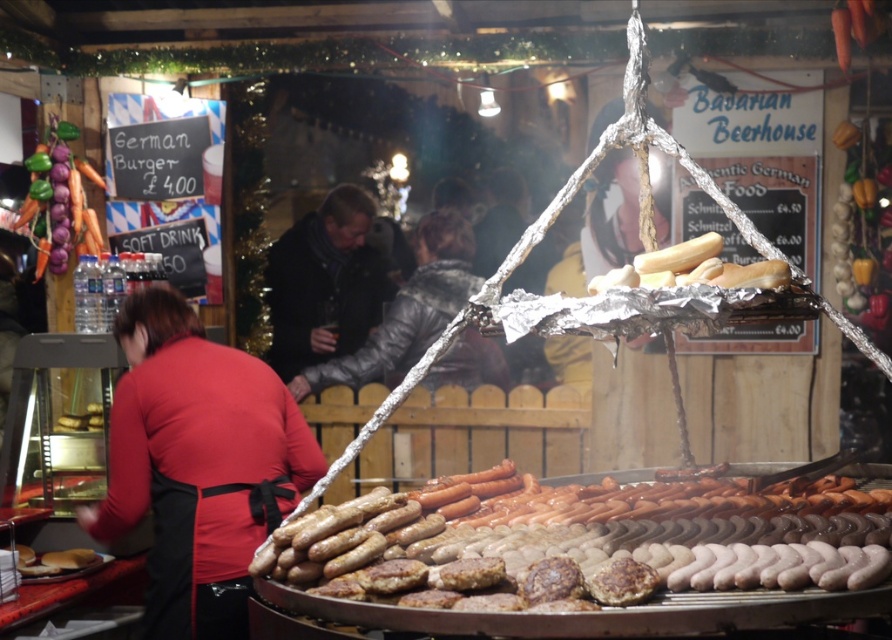
Which is behind, point (303, 476) or point (68, 564)?

Point (68, 564)

Looking at this image, can you confirm if red fabric apron at left is positioned above brown matte sausage at center?

Yes.

I want to click on red fabric apron at left, so click(x=197, y=465).

Which is more to the right, carrot vegetable at left or golden bread at center?

From the viewer's perspective, golden bread at center appears more on the right side.

Is carrot vegetable at left behind golden bread at center?

Yes, carrot vegetable at left is behind golden bread at center.

This screenshot has height=640, width=892. What do you see at coordinates (59, 200) in the screenshot?
I see `carrot vegetable at left` at bounding box center [59, 200].

The image size is (892, 640). What are the coordinates of `carrot vegetable at left` in the screenshot? It's located at (59, 200).

The height and width of the screenshot is (640, 892). Describe the element at coordinates (197, 465) in the screenshot. I see `red fabric apron at left` at that location.

Identify the location of red fabric apron at left. (197, 465).